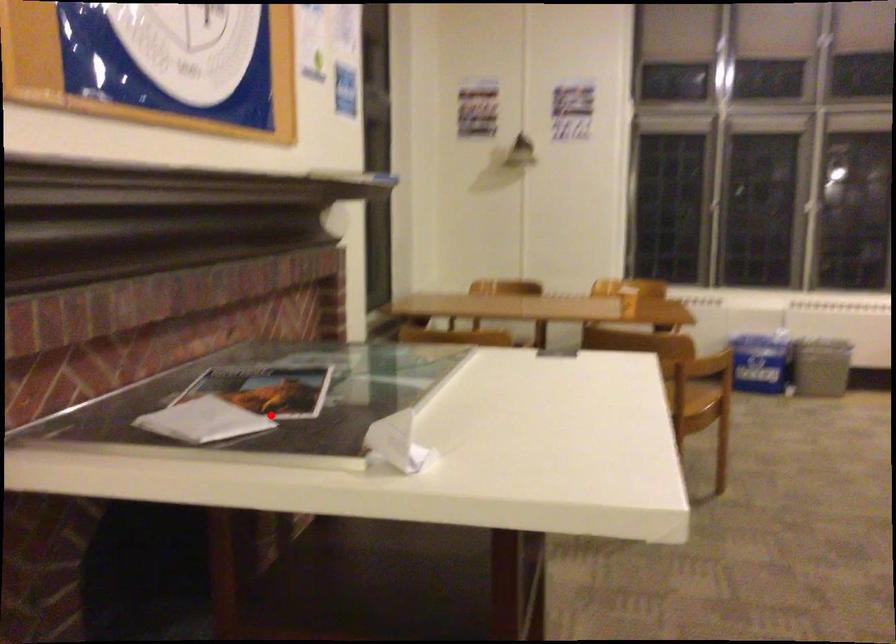
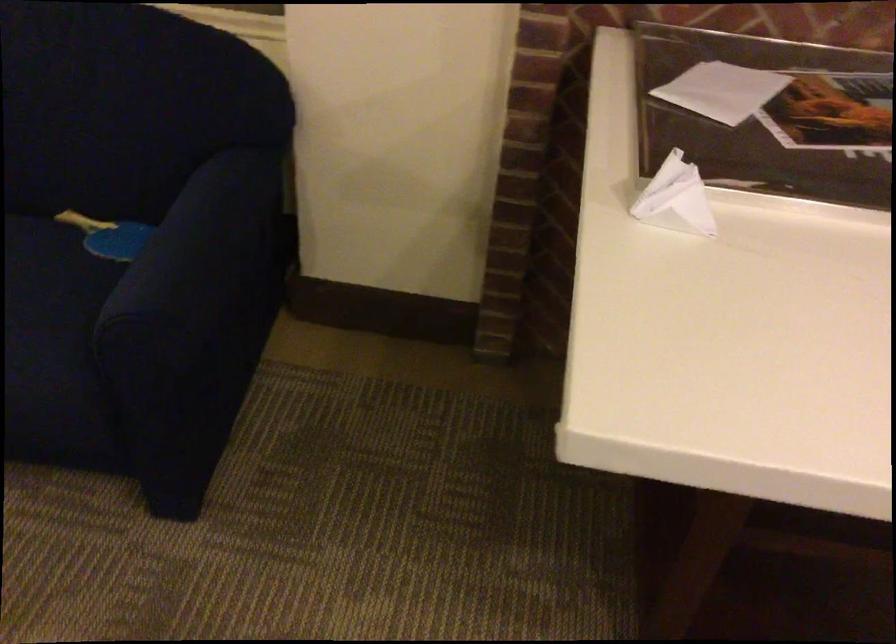
The point at the highlighted location is marked in the first image. Where is the corresponding point in the second image?

(771, 117)